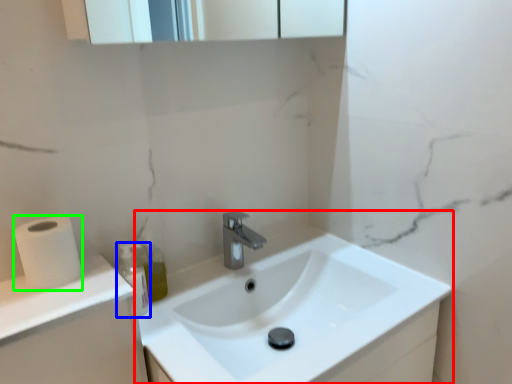
Question: Estimate the real-world distances between objects in this image. Which object is farther from sink (highlighted by a red box), bottle (highlighted by a blue box) or toilet paper (highlighted by a green box)?

Choices:
 (A) bottle
 (B) toilet paper

Answer: (B)